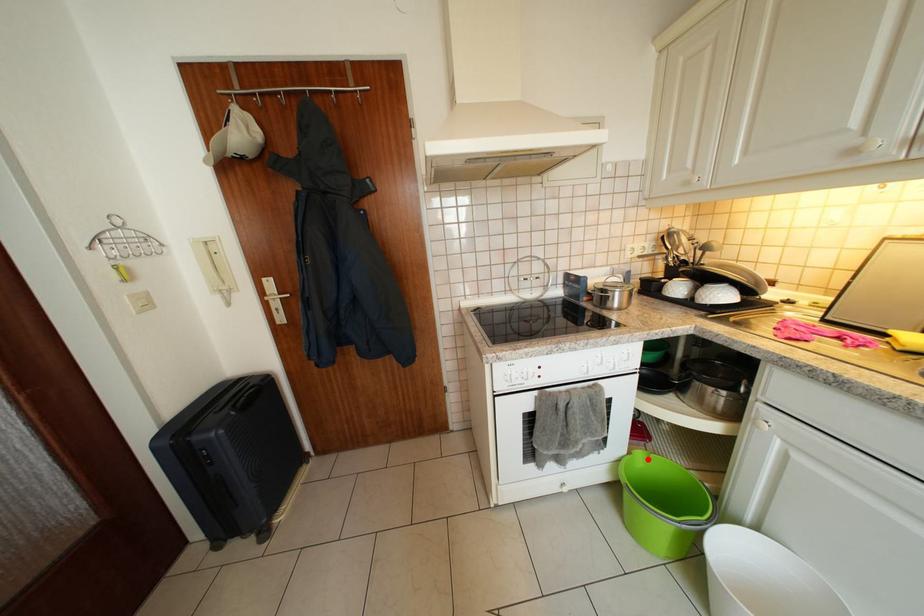
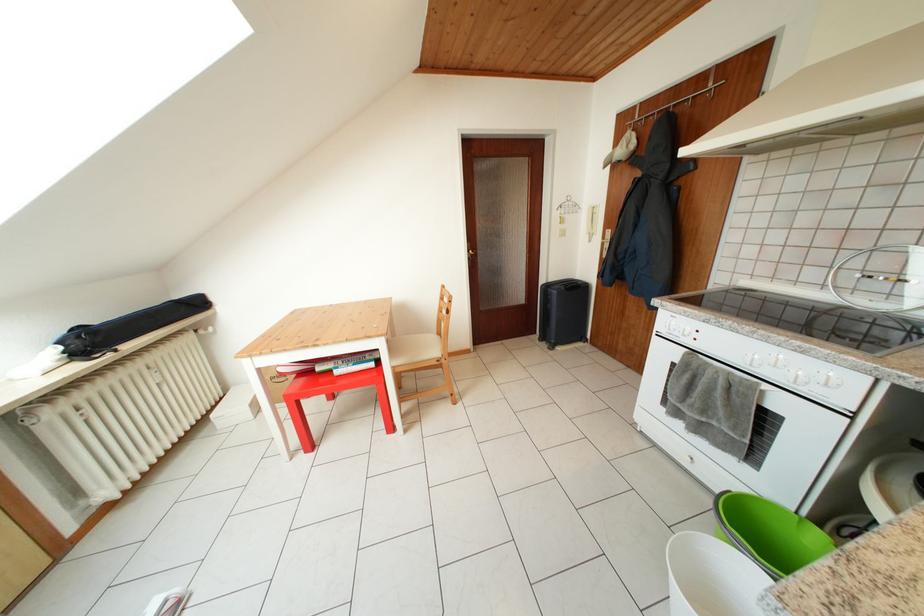
Question: I am providing you with two images of the same scene from different viewpoints. A red point is shown in image1. For the corresponding object point in image2, is it positioned nearer or farther from the camera?

Choices:
 (A) Nearer
 (B) Farther

Answer: (B)